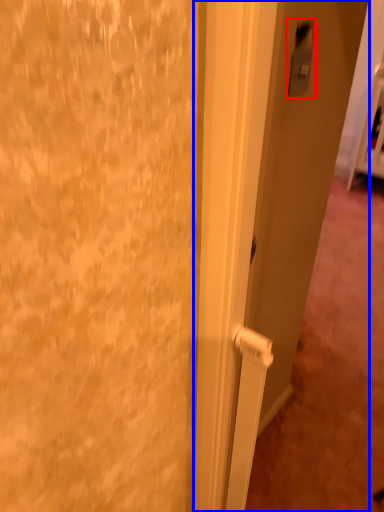
Question: Among these objects, which one is nearest to the camera, light switch (highlighted by a red box) or door (highlighted by a blue box)?

Choices:
 (A) light switch
 (B) door

Answer: (B)